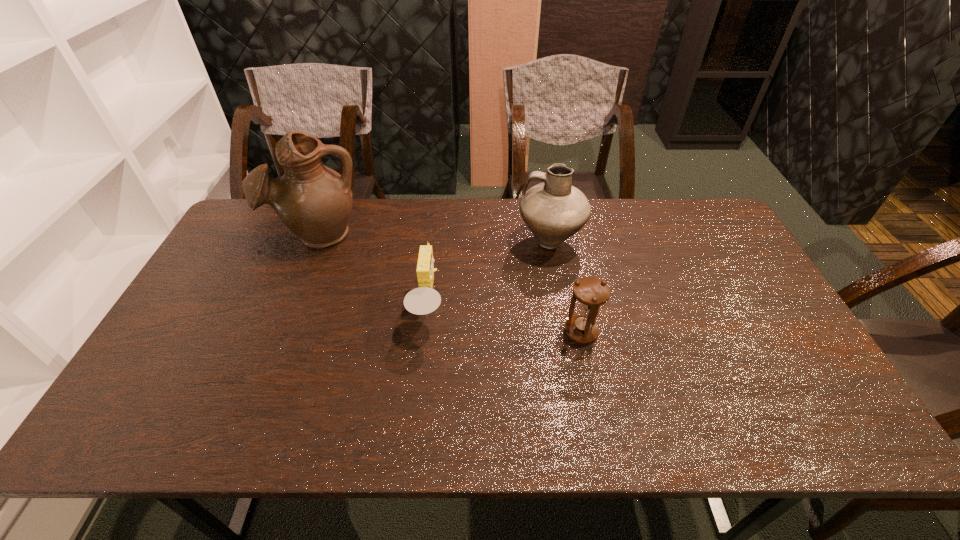
You are a GUI agent. You are given a task and a screenshot of the screen. Output one action in this format:
    pyautogui.click(x=<x>, y=<y>)
    Task: Click on the vacant point located 0.050m on the back of the hourglass
    This screenshot has width=960, height=540.
    Given the screenshot: What is the action you would take?
    pyautogui.click(x=575, y=306)

What are the coordinates of `blank area located on the front-facing side of the second object from left to right` in the screenshot? It's located at (488, 307).

Locate an element on the screen. object located in the left edge section of the desktop is located at coordinates (313, 201).

Locate an element on the screen. The height and width of the screenshot is (540, 960). object at the far left corner is located at coordinates (313, 201).

The width and height of the screenshot is (960, 540). In order to click on free space at the far edge of the desktop in this screenshot , I will do `click(464, 219)`.

Locate an element on the screen. This screenshot has height=540, width=960. vacant area at the near edge of the desktop is located at coordinates (316, 412).

The height and width of the screenshot is (540, 960). I want to click on vacant space at the left edge of the desktop, so click(241, 313).

You are a GUI agent. You are given a task and a screenshot of the screen. Output one action in this format:
    pyautogui.click(x=<x>, y=<y>)
    Task: Click on the free space at the right edge
    
    Given the screenshot: What is the action you would take?
    pyautogui.click(x=721, y=254)

Where is `vacant area at the far left corner`? vacant area at the far left corner is located at coordinates [x=238, y=243].

This screenshot has height=540, width=960. Find the location of `vacant space that is in between the shorter pitcher and the hourglass`. vacant space that is in between the shorter pitcher and the hourglass is located at coordinates (565, 287).